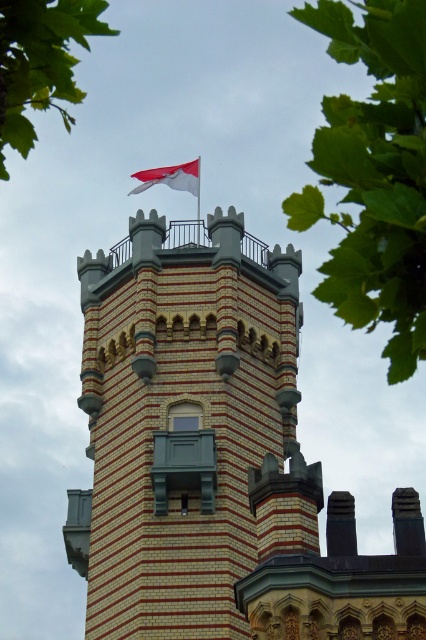
Question: Among these objects, which one is nearest to the camera?

Choices:
 (A) brick tower at center
 (B) green leafy tree at upper left

Answer: (B)

Question: Based on their relative distances, which object is farther from the green leafy tree at upper left?

Choices:
 (A) brick tower at center
 (B) green leafy tree at upper center

Answer: (A)

Question: Does brick tower at center appear on the left side of green leafy tree at upper left?

Choices:
 (A) no
 (B) yes

Answer: (A)

Question: Can you confirm if brick tower at center is positioned above green leafy tree at upper left?

Choices:
 (A) yes
 (B) no

Answer: (B)

Question: Does brick tower at center appear on the left side of white fabric flag at top?

Choices:
 (A) yes
 (B) no

Answer: (B)

Question: Which point is farther to the camera?

Choices:
 (A) (399, 180)
 (B) (175, 177)
 (C) (100, 540)

Answer: (B)